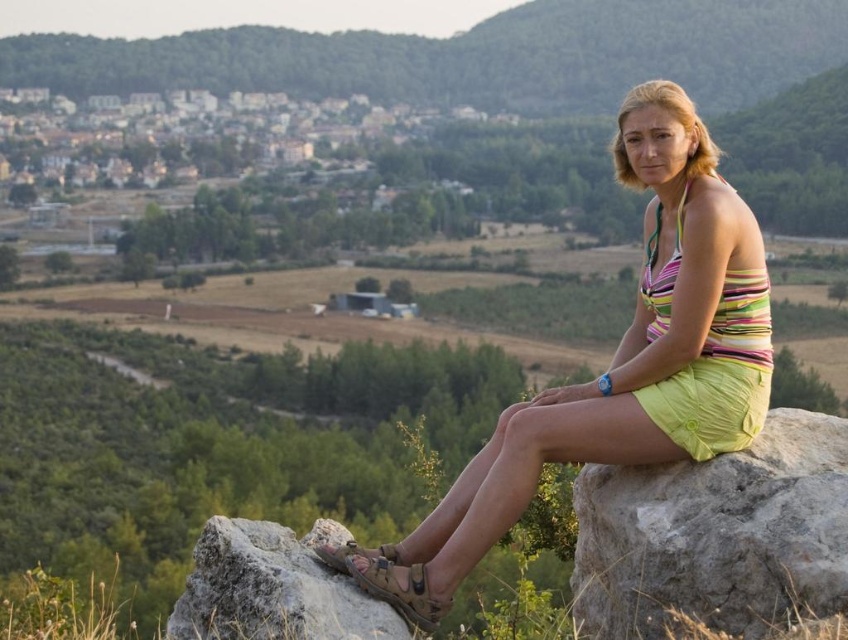
Between yellow cotton shorts at center and brown leather sandal at lower center, which one is positioned lower?

Positioned lower is brown leather sandal at lower center.

Between yellow cotton shorts at center and brown leather sandal at lower center, which one appears on the right side from the viewer's perspective?

yellow cotton shorts at center

Between point (766, 371) and point (395, 552), which one is positioned in front?

Point (395, 552) is more forward.

In order to click on yellow cotton shorts at center in this screenshot , I will do `click(636, 348)`.

Between brown leather sandal at lower center and brown suede sandal at lower center, which one is positioned higher?

brown suede sandal at lower center is above.

Is point (409, 593) farther from camera compared to point (322, 548)?

No.

The image size is (848, 640). Find the location of `brown leather sandal at lower center`. brown leather sandal at lower center is located at coordinates (388, 579).

Where is `brown leather sandal at lower center`? brown leather sandal at lower center is located at coordinates (388, 579).

Is the position of yellow cotton shorts at center less distant than that of yellow fabric shorts at right?

Yes, it is in front of yellow fabric shorts at right.

Which is in front, point (717, 419) or point (674, 400)?

Point (717, 419)

The height and width of the screenshot is (640, 848). What are the coordinates of `yellow cotton shorts at center` in the screenshot? It's located at (636, 348).